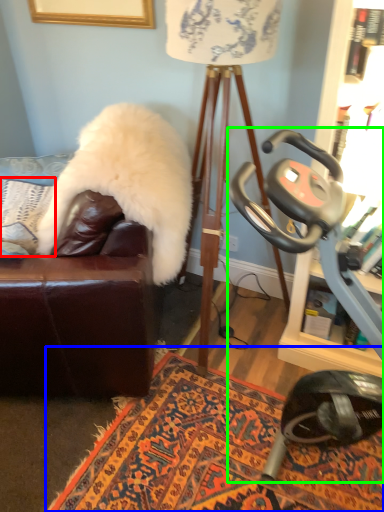
Question: Which object is positioned farthest from pillow (highlighted by a red box)? Select from mat (highlighted by a blue box) and stationary bicycle (highlighted by a green box).

Choices:
 (A) mat
 (B) stationary bicycle

Answer: (B)